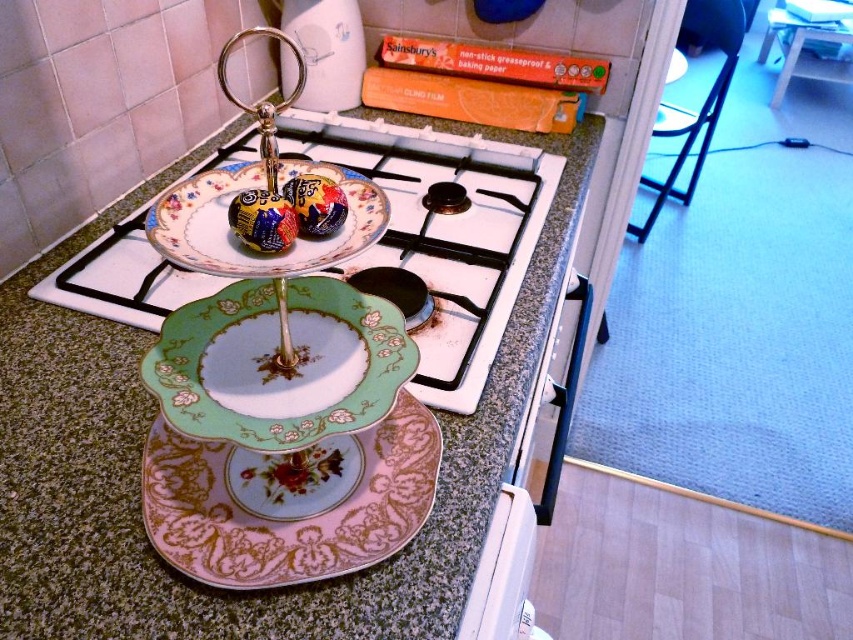
Can you confirm if pink porcelain platter at center is positioned below matte ceramic chocolate at center?

Yes, pink porcelain platter at center is below matte ceramic chocolate at center.

Consider the image. Does pink porcelain platter at center have a smaller size compared to matte ceramic chocolate at center?

No, pink porcelain platter at center is not smaller than matte ceramic chocolate at center.

Which is in front, point (375, 504) or point (265, 193)?

Point (265, 193) is more forward.

Identify the location of pink porcelain platter at center. (289, 500).

Is point (337, 172) closer to camera compared to point (280, 195)?

No, (337, 172) is further to viewer.

Is porcelain floral plate at center thinner than matte ceramic chocolate at center?

Incorrect, porcelain floral plate at center's width is not less than matte ceramic chocolate at center's.

Locate an element on the screen. porcelain floral plate at center is located at coordinates (238, 240).

Does porcelain plate at center have a larger size compared to matte ceramic chocolate at center?

Yes.

Does porcelain plate at center appear on the right side of matte ceramic chocolate at center?

Incorrect, porcelain plate at center is not on the right side of matte ceramic chocolate at center.

This screenshot has width=853, height=640. Find the location of `porcelain plate at center`. porcelain plate at center is located at coordinates (140, 454).

Find the location of a particular element. The image size is (853, 640). porcelain plate at center is located at coordinates (140, 454).